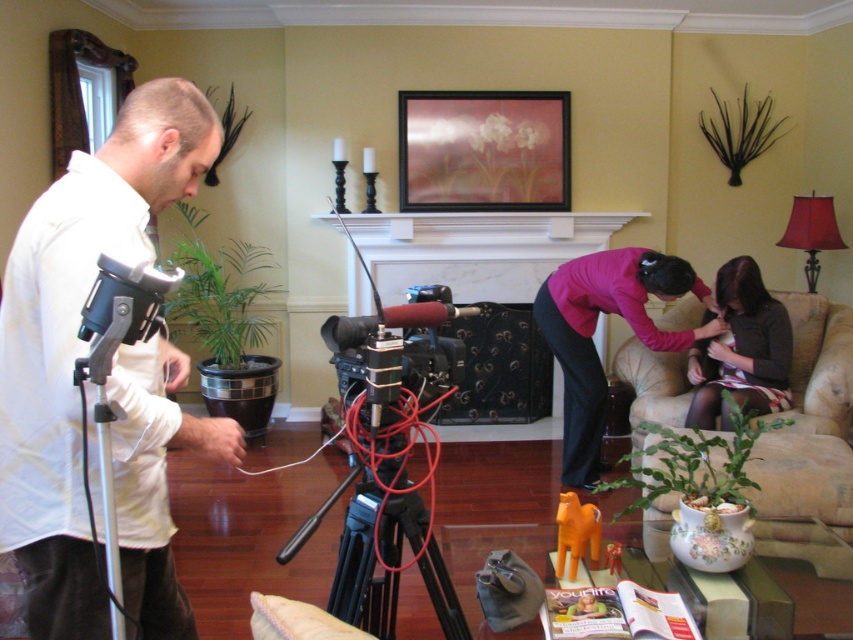
Is white matte tripod at left positioned before black matte tripod at center?

Yes.

Does white matte tripod at left appear under black matte tripod at center?

No, white matte tripod at left is not below black matte tripod at center.

Does point (172, 148) come farther from viewer compared to point (363, 611)?

No.

The width and height of the screenshot is (853, 640). Identify the location of white matte tripod at left. (77, 339).

Is white matte tripod at left bigger than metallic gold picture frame at upper center?

Correct, white matte tripod at left is larger in size than metallic gold picture frame at upper center.

From the picture: Is white matte tripod at left positioned behind metallic gold picture frame at upper center?

No, white matte tripod at left is in front of metallic gold picture frame at upper center.

Who is more distant from viewer, (80, 269) or (469, 138)?

The point (469, 138) is behind.

Locate an element on the screen. The image size is (853, 640). white matte tripod at left is located at coordinates (77, 339).

Between black marble fireplace at center and pink fabric at center, which one is positioned higher?

black marble fireplace at center is higher up.

Is black marble fireplace at center positioned at the back of pink fabric at center?

Yes, it is.

This screenshot has height=640, width=853. In order to click on black marble fireplace at center in this screenshot , I will do `click(476, 250)`.